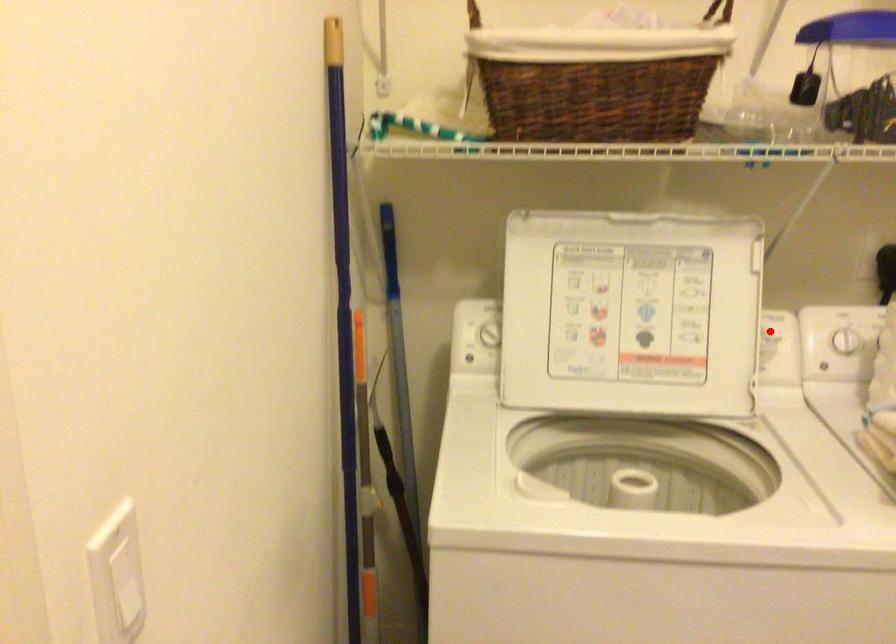
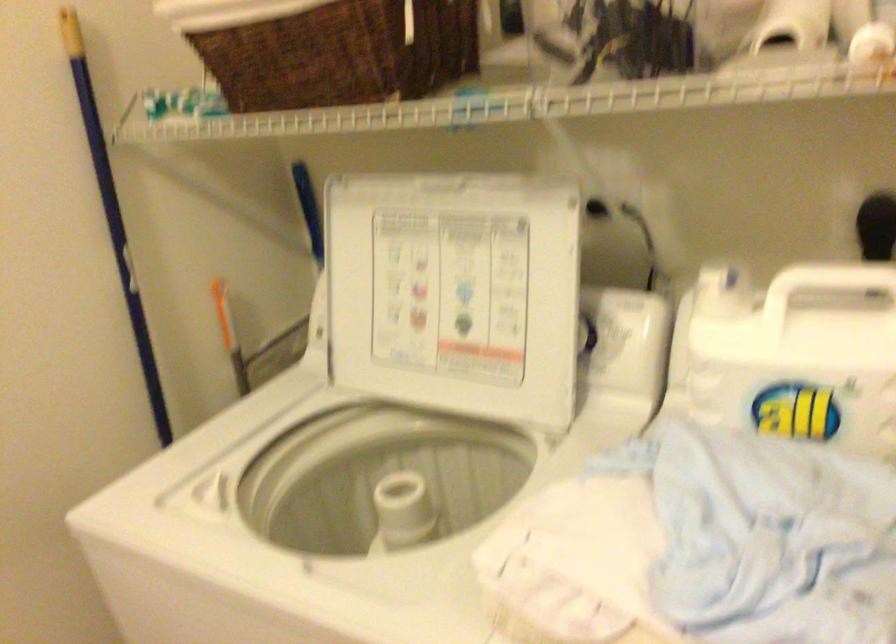
Where in the second image is the point corresponding to the highlighted location from the first image?

(616, 325)